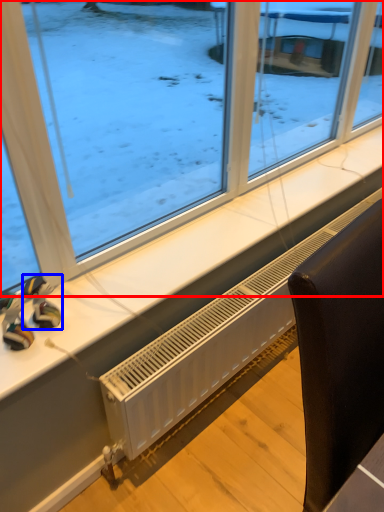
Question: Which object appears farthest to the camera in this image, window (highlighted by a red box) or toy (highlighted by a blue box)?

Choices:
 (A) window
 (B) toy

Answer: (B)